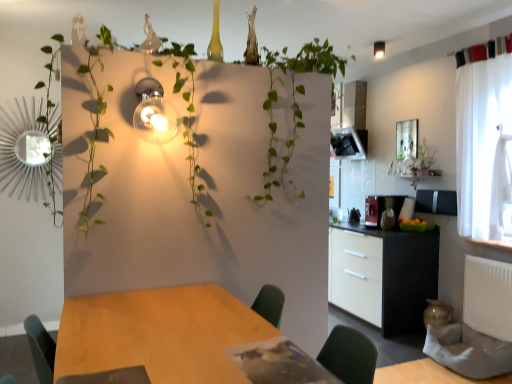
This screenshot has height=384, width=512. In order to click on empty space that is ontop of wooden table at center in this screenshot , I will do `click(182, 331)`.